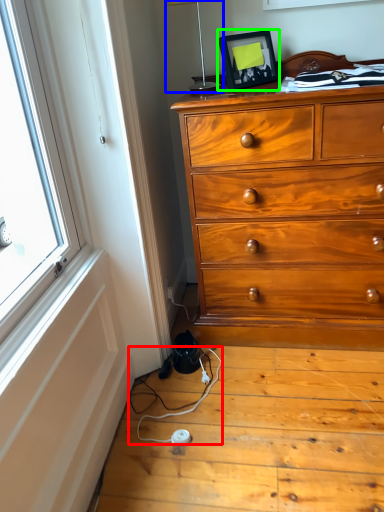
Question: Which object is the farthest from twin (highlighted by a red box)? Choose among these: table lamp (highlighted by a blue box) or picture frame (highlighted by a green box).

Choices:
 (A) table lamp
 (B) picture frame

Answer: (A)